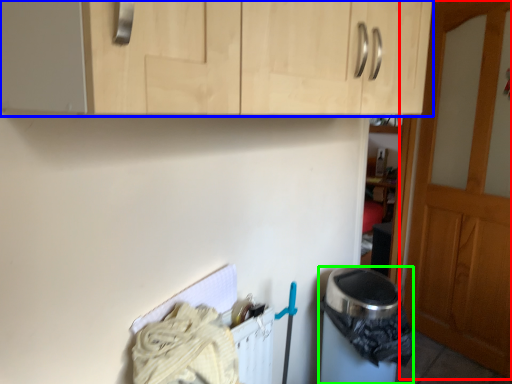
Question: Which object is positioned closest to door (highlighted by a red box)? Select from cabinetry (highlighted by a blue box) and appliance (highlighted by a green box).

Choices:
 (A) cabinetry
 (B) appliance

Answer: (B)